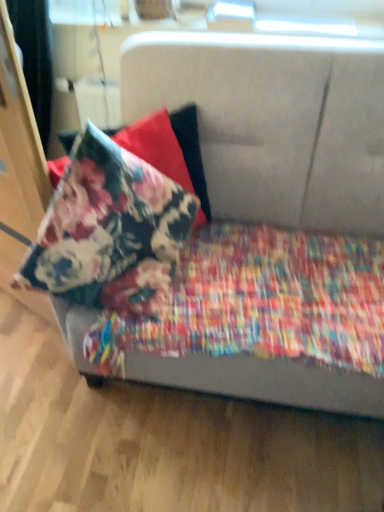
Question: Is textured fabric couch at center not inside floral fabric pillow at upper left?

Choices:
 (A) yes
 (B) no

Answer: (A)

Question: Is textured fabric couch at center facing towards floral fabric pillow at upper left?

Choices:
 (A) no
 (B) yes

Answer: (B)

Question: From the image's perspective, is textured fabric couch at center below floral fabric pillow at upper left?

Choices:
 (A) no
 (B) yes

Answer: (B)

Question: Does textured fabric couch at center appear on the left side of floral fabric pillow at upper left?

Choices:
 (A) yes
 (B) no

Answer: (B)

Question: Is textured fabric couch at center turned away from floral fabric pillow at upper left?

Choices:
 (A) no
 (B) yes

Answer: (A)

Question: In terms of size, does textured fabric couch at center appear bigger or smaller than floral fabric pillow at upper left?

Choices:
 (A) small
 (B) big

Answer: (B)

Question: From the image's perspective, is textured fabric couch at center positioned above or below floral fabric pillow at upper left?

Choices:
 (A) below
 (B) above

Answer: (A)

Question: Is textured fabric couch at center wider or thinner than floral fabric pillow at upper left?

Choices:
 (A) thin
 (B) wide

Answer: (B)

Question: Relative to floral fabric pillow at upper left, is textured fabric couch at center in front or behind?

Choices:
 (A) behind
 (B) front

Answer: (B)

Question: Do you think textured fabric couch at center is within floral cotton blanket at lower left, or outside of it?

Choices:
 (A) inside
 (B) outside

Answer: (B)

Question: In terms of height, does textured fabric couch at center look taller or shorter compared to floral cotton blanket at lower left?

Choices:
 (A) tall
 (B) short

Answer: (A)

Question: Is textured fabric couch at center to the left or to the right of floral cotton blanket at lower left in the image?

Choices:
 (A) left
 (B) right

Answer: (B)

Question: Considering the positions of point (327, 61) and point (380, 343), is point (327, 61) closer or farther from the camera than point (380, 343)?

Choices:
 (A) farther
 (B) closer

Answer: (A)

Question: From a real-world perspective, is floral fabric pillow at upper left physically located above or below floral cotton blanket at lower left?

Choices:
 (A) below
 (B) above

Answer: (B)

Question: Is point (162, 182) positioned closer to the camera than point (180, 298)?

Choices:
 (A) farther
 (B) closer

Answer: (B)